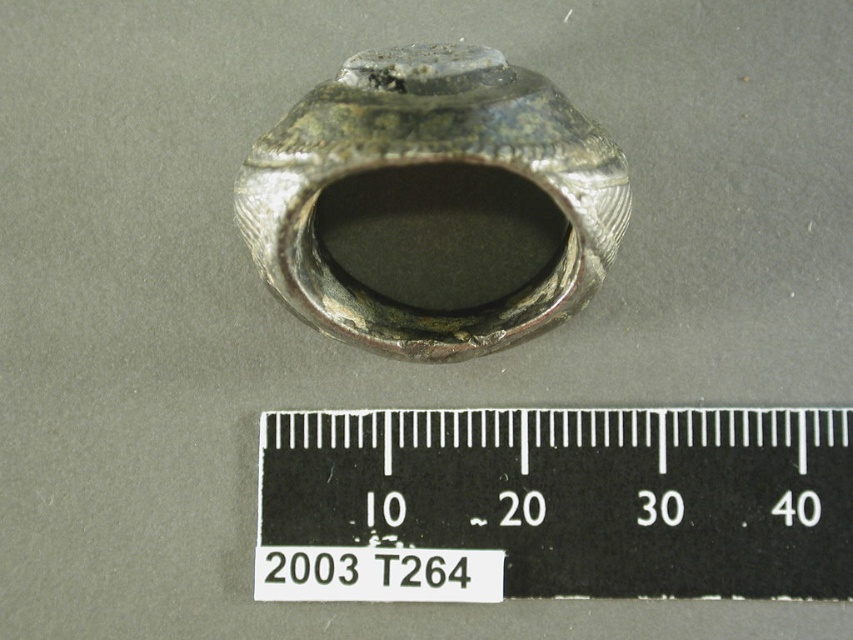
Question: Is the position of black plastic ruler at center more distant than that of silver metallic ring at center?

Choices:
 (A) yes
 (B) no

Answer: (A)

Question: Does black plastic ruler at center appear on the right side of silver metallic ring at center?

Choices:
 (A) no
 (B) yes

Answer: (B)

Question: Which point is closer to the camera taking this photo?

Choices:
 (A) (758, 529)
 (B) (606, 164)

Answer: (B)

Question: Which point is farther to the camera?

Choices:
 (A) black plastic ruler at center
 (B) silver metallic ring at center

Answer: (A)

Question: Does black plastic ruler at center appear on the right side of silver metallic ring at center?

Choices:
 (A) yes
 (B) no

Answer: (A)